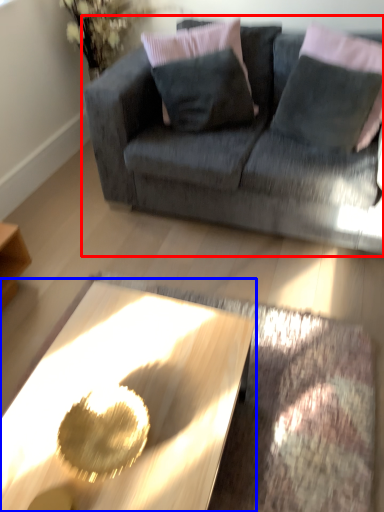
Question: Which object is closer to the camera taking this photo, studio couch (highlighted by a red box) or coffee table (highlighted by a blue box)?

Choices:
 (A) studio couch
 (B) coffee table

Answer: (B)